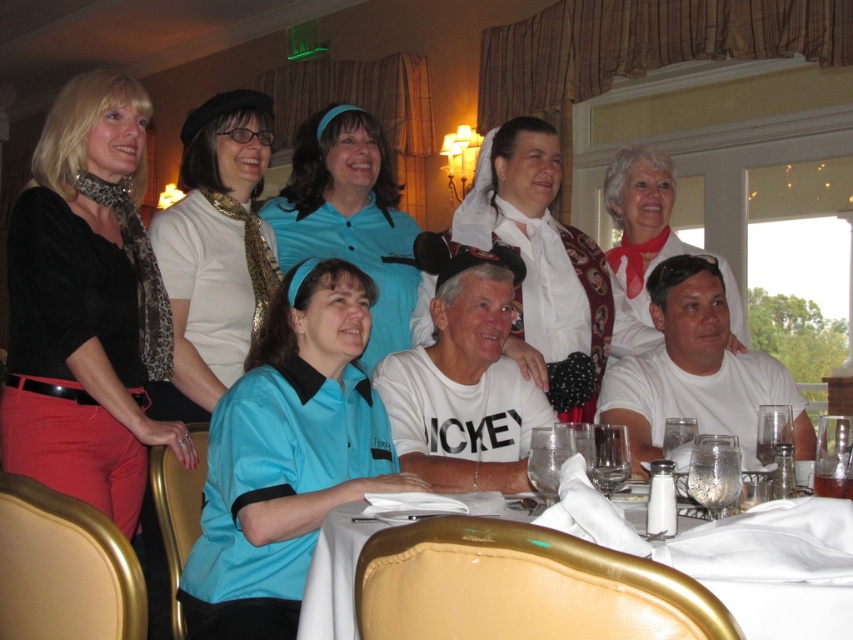
Can you confirm if white cloth at lower center is thinner than blue fabric shirt at center?

Yes, white cloth at lower center is thinner than blue fabric shirt at center.

Which is behind, point (775, 632) or point (529, 381)?

The point (529, 381) is behind.

Where is `white cloth at lower center`? The height and width of the screenshot is (640, 853). white cloth at lower center is located at coordinates (740, 556).

Identify the location of white cloth at lower center. (740, 556).

Does velvet black shirt at upper left appear on the left side of blue jersey at center?

Indeed, velvet black shirt at upper left is positioned on the left side of blue jersey at center.

Is velvet black shirt at upper left bigger than blue jersey at center?

No, velvet black shirt at upper left is not bigger than blue jersey at center.

Locate an element on the screen. The height and width of the screenshot is (640, 853). velvet black shirt at upper left is located at coordinates (86, 307).

Between blue fabric shirt at center and white matte shirt at lower right, which one appears on the left side from the viewer's perspective?

From the viewer's perspective, blue fabric shirt at center appears more on the left side.

Does blue fabric shirt at center appear under white matte shirt at lower right?

Incorrect, blue fabric shirt at center is not positioned below white matte shirt at lower right.

Is point (447, 275) more distant than point (686, 369)?

No, it is not.

Locate an element on the screen. The height and width of the screenshot is (640, 853). blue fabric shirt at center is located at coordinates (463, 378).